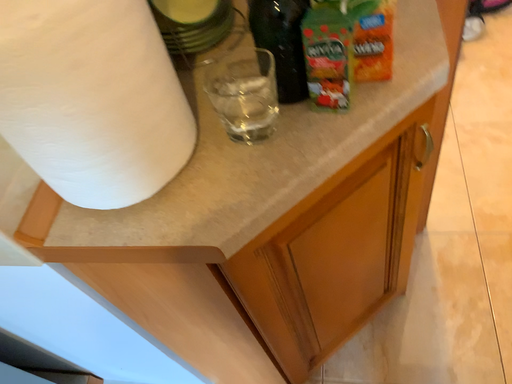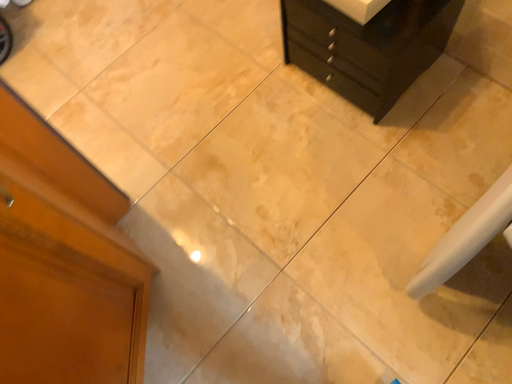
Question: Which way did the camera rotate in the video?

Choices:
 (A) rotated right
 (B) rotated left

Answer: (A)